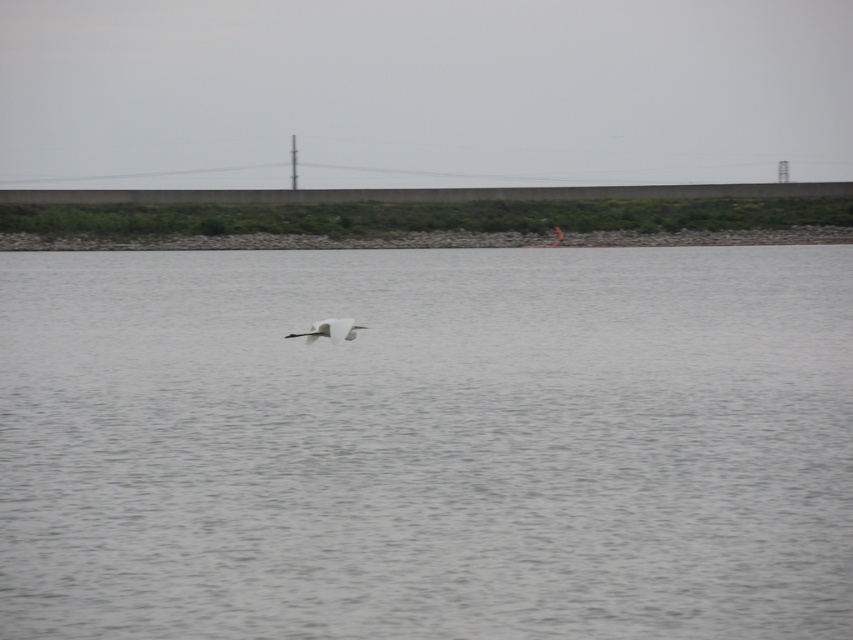
You are a photographer trying to capture the white matte bird at center flying over the gray water at center. Based on the scene, which object is positioned higher in the image?

The gray water at center is taller than the white matte bird at center, so the water is positioned higher in the image.

You are observing the scene and want to determine which of the two points, point (x=589, y=595) or point (x=354, y=324), is closer to you. Based on the image, which point is nearer?

Point (x=589, y=595) is closer to the camera than point (x=354, y=324).